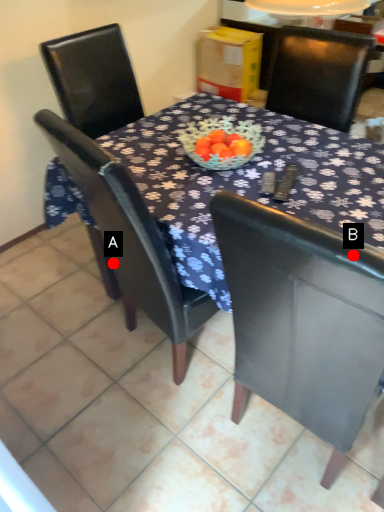
Question: Two points are circled on the image, labeled by A and B beside each circle. Among these points, which one is nearest to the camera?

Choices:
 (A) A is closer
 (B) B is closer

Answer: (B)